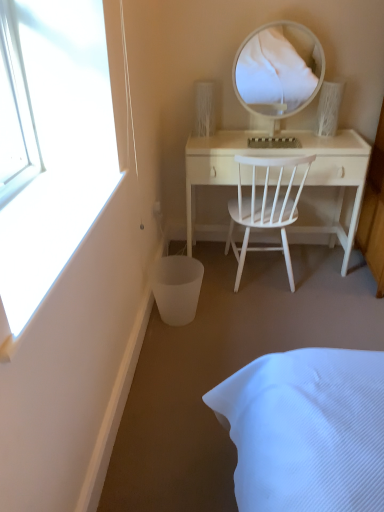
Question: Does white wood desk at center appear on the right side of white glossy mirror at upper center?

Choices:
 (A) no
 (B) yes

Answer: (B)

Question: Can you confirm if white wood desk at center is shorter than white glossy mirror at upper center?

Choices:
 (A) yes
 (B) no

Answer: (B)

Question: Is white wood desk at center positioned far away from white glossy mirror at upper center?

Choices:
 (A) yes
 (B) no

Answer: (A)

Question: Would you say white glossy mirror at upper center is part of white wood desk at center's contents?

Choices:
 (A) yes
 (B) no

Answer: (B)

Question: From the image's perspective, would you say white wood desk at center is shown under white glossy mirror at upper center?

Choices:
 (A) no
 (B) yes

Answer: (B)

Question: From a real-world perspective, relative to white wood desk at center, is white glossy mirror at upper center vertically above or below?

Choices:
 (A) above
 (B) below

Answer: (A)

Question: From the image's perspective, is white glossy mirror at upper center located above or below white wood desk at center?

Choices:
 (A) below
 (B) above

Answer: (B)

Question: Is point (297, 61) positioned closer to the camera than point (354, 218)?

Choices:
 (A) closer
 (B) farther

Answer: (B)

Question: In the image, is white glossy mirror at upper center on the left side or the right side of white wood desk at center?

Choices:
 (A) left
 (B) right

Answer: (A)

Question: Is white matte trash bin/can at lower left wider or thinner than white glossy mirror at upper center?

Choices:
 (A) wide
 (B) thin

Answer: (A)

Question: From the image's perspective, is white matte trash bin/can at lower left above or below white glossy mirror at upper center?

Choices:
 (A) below
 (B) above

Answer: (A)

Question: Would you say white matte trash bin/can at lower left is to the left or to the right of white glossy mirror at upper center in the picture?

Choices:
 (A) left
 (B) right

Answer: (A)

Question: Considering their positions, is white matte trash bin/can at lower left located in front of or behind white glossy mirror at upper center?

Choices:
 (A) behind
 (B) front

Answer: (B)

Question: From a real-world perspective, is white wood desk at center above or below white wood chair at center?

Choices:
 (A) below
 (B) above

Answer: (A)

Question: Visually, is white wood desk at center positioned to the left or to the right of white wood chair at center?

Choices:
 (A) left
 (B) right

Answer: (B)